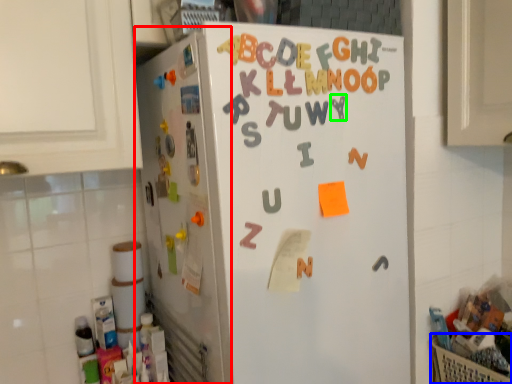
Question: Which object is the farthest from appliance (highlighted by a red box)? Choose among these: basket (highlighted by a blue box) or letter (highlighted by a green box).

Choices:
 (A) basket
 (B) letter

Answer: (A)